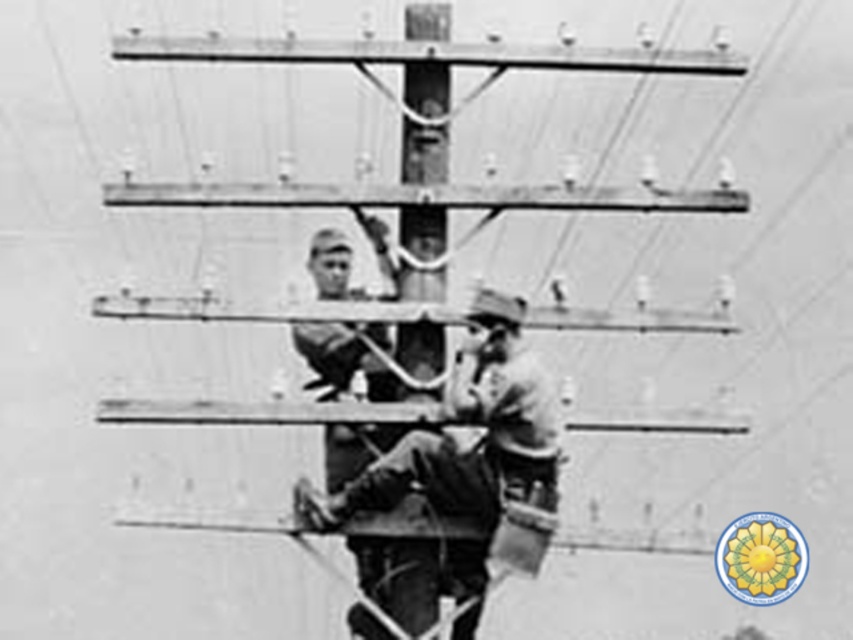
Question: Observing the image, what is the correct spatial positioning of smooth leather gloves at center in reference to smooth wood telegraph pole at center?

Choices:
 (A) left
 (B) right

Answer: (B)

Question: Which object is farther from the camera taking this photo?

Choices:
 (A) smooth wood telegraph pole at center
 (B) smooth leather gloves at center

Answer: (A)

Question: Can you confirm if smooth leather gloves at center is smaller than smooth wood telegraph pole at center?

Choices:
 (A) no
 (B) yes

Answer: (A)

Question: Does smooth leather gloves at center have a larger size compared to smooth wood telegraph pole at center?

Choices:
 (A) no
 (B) yes

Answer: (B)